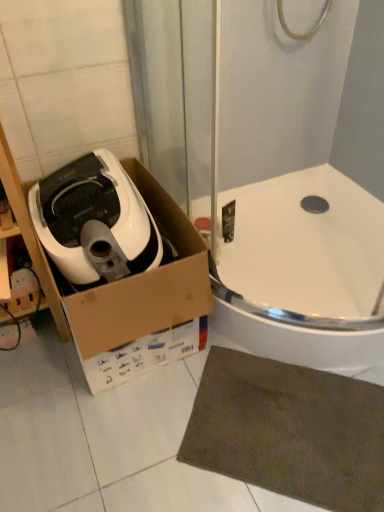
Question: From the image's perspective, is white matte air fryer at left above white glossy bath at center?

Choices:
 (A) yes
 (B) no

Answer: (A)

Question: Considering the relative sizes of white matte air fryer at left and white glossy bath at center in the image provided, is white matte air fryer at left thinner than white glossy bath at center?

Choices:
 (A) yes
 (B) no

Answer: (A)

Question: From a real-world perspective, is white matte air fryer at left positioned over white glossy bath at center based on gravity?

Choices:
 (A) yes
 (B) no

Answer: (A)

Question: Can you confirm if white matte air fryer at left is positioned to the right of white glossy bath at center?

Choices:
 (A) no
 (B) yes

Answer: (A)

Question: Does white matte air fryer at left turn towards white glossy bath at center?

Choices:
 (A) no
 (B) yes

Answer: (A)

Question: Considering the relative positions of white cardboard box at left and brown textured bath mat at lower right in the image provided, is white cardboard box at left to the left or to the right of brown textured bath mat at lower right?

Choices:
 (A) right
 (B) left

Answer: (B)

Question: Looking at their shapes, would you say white cardboard box at left is wider or thinner than brown textured bath mat at lower right?

Choices:
 (A) thin
 (B) wide

Answer: (B)

Question: Does point (49, 201) appear closer or farther from the camera than point (203, 453)?

Choices:
 (A) closer
 (B) farther

Answer: (B)

Question: From the image's perspective, relative to brown textured bath mat at lower right, is white cardboard box at left above or below?

Choices:
 (A) below
 (B) above

Answer: (B)

Question: Which is correct: white cardboard box at left is inside white glossy bath at center, or outside of it?

Choices:
 (A) outside
 (B) inside

Answer: (A)

Question: Looking at their shapes, would you say white cardboard box at left is wider or thinner than white glossy bath at center?

Choices:
 (A) wide
 (B) thin

Answer: (B)

Question: Considering the relative positions of white cardboard box at left and white glossy bath at center in the image provided, is white cardboard box at left to the left or to the right of white glossy bath at center?

Choices:
 (A) left
 (B) right

Answer: (A)

Question: From the image's perspective, is white cardboard box at left located above or below white glossy bath at center?

Choices:
 (A) below
 (B) above

Answer: (A)

Question: Do you think white matte air fryer at left is within white cardboard box at left, or outside of it?

Choices:
 (A) inside
 (B) outside

Answer: (A)

Question: Considering the positions of white matte air fryer at left and white cardboard box at left in the image, is white matte air fryer at left bigger or smaller than white cardboard box at left?

Choices:
 (A) big
 (B) small

Answer: (B)